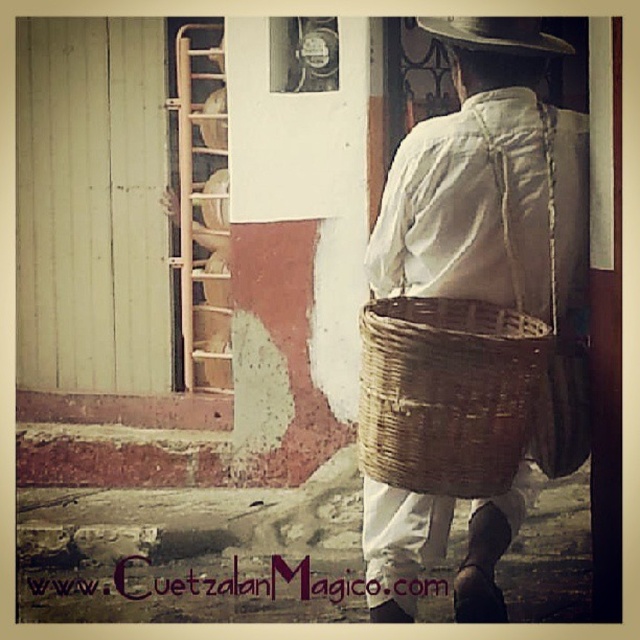
Consider the image. You are a delivery person who needs to place a 36 inch long package between the woven brown basket at back and the brown woven straw hat at upper center. Can you fit it there?

The distance between the woven brown basket at back and the brown woven straw hat at upper center is 35.85 inches. Since the package is 36 inches long, it is slightly too long to fit between them.

You are an observer standing in front of the weathered building. You notice a woven brown basket at back and a brown woven straw hat at upper center. Which object is wider?

The woven brown basket at back is wider than the brown woven straw hat at upper center because its width surpasses the hat.

You are a delivery person who needs to place a 12 inch package between the woven straw basket at back and the brown woven straw hat at upper center. Can you fit it there?

The distance between the woven straw basket at back and the brown woven straw hat at upper center is 12.36 inches, so yes, the 12 inch package can fit between them since it is slightly smaller than the available space.